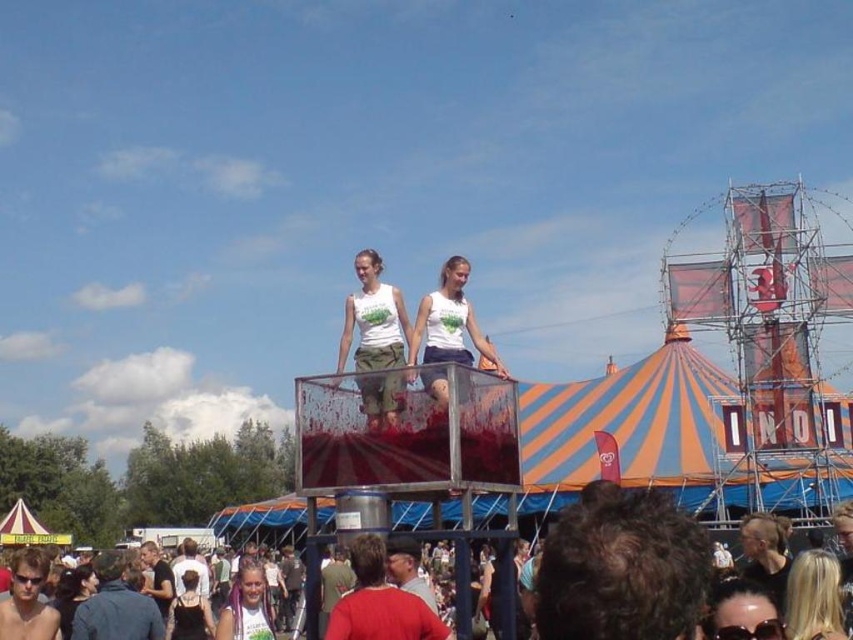
You are a photographer at the event and want to capture a photo that includes both the matte white tank tops at center and the black leather dress at lower center. Which object should you focus on first to ensure both are in the frame?

The matte white tank tops at center is positioned over the black leather dress at lower center, so focusing on the matte white tank tops at center first will ensure both are in the frame.

You are a photographer at the event and want to capture both the matte white tank tops at center and the blonde hair at lower right in a single frame. Which object should you focus on first to ensure both are in the frame?

The matte white tank tops at center are wider than the blonde hair at lower right, so focusing on the matte white tank tops at center first will help ensure both are included in the frame.